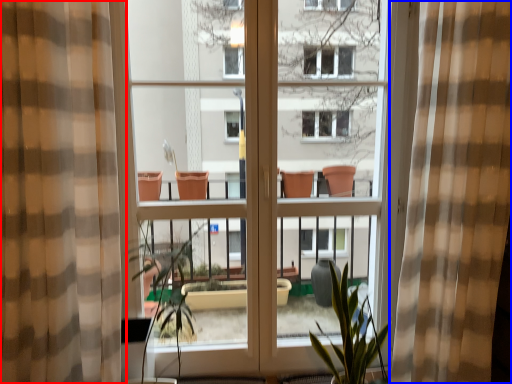
Question: Which of the following is the closest to the observer, curtain (highlighted by a red box) or curtain (highlighted by a blue box)?

Choices:
 (A) curtain
 (B) curtain

Answer: (A)